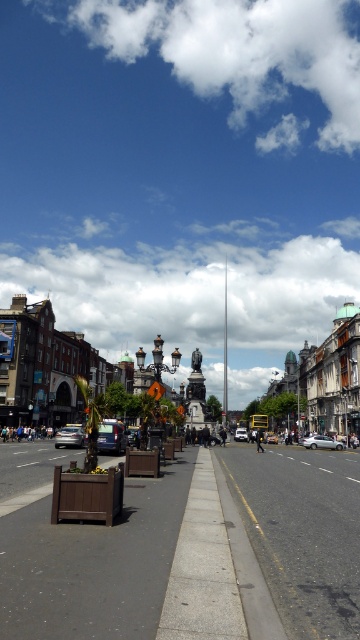
Looking at this image, you are a delivery person needing to park your vehicle. You see a metallic silver car at left and a yellow metallic taxi at center. Which parking spot is closer to the sidewalk?

The metallic silver car at left is closer to the sidewalk than the yellow metallic taxi at center because it is positioned to the left of it, and the sidewalk is on the left side of the street.